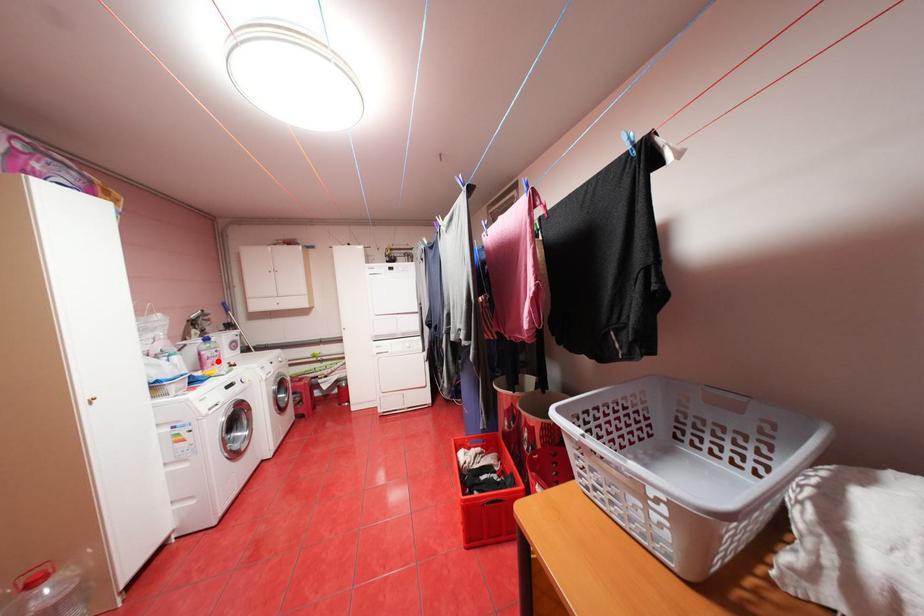
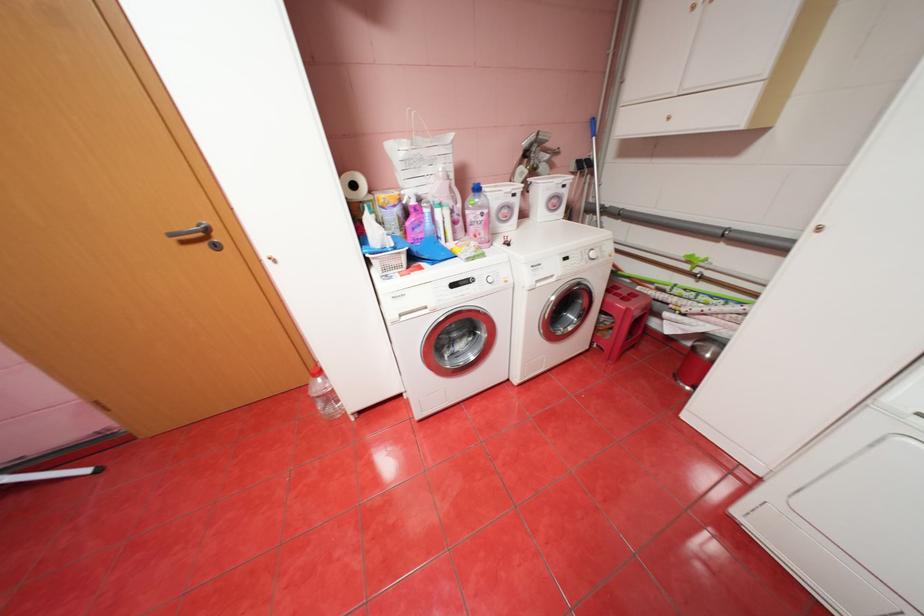
Where in the second image is the point corresponding to the highlighted location from the first image?

(480, 228)